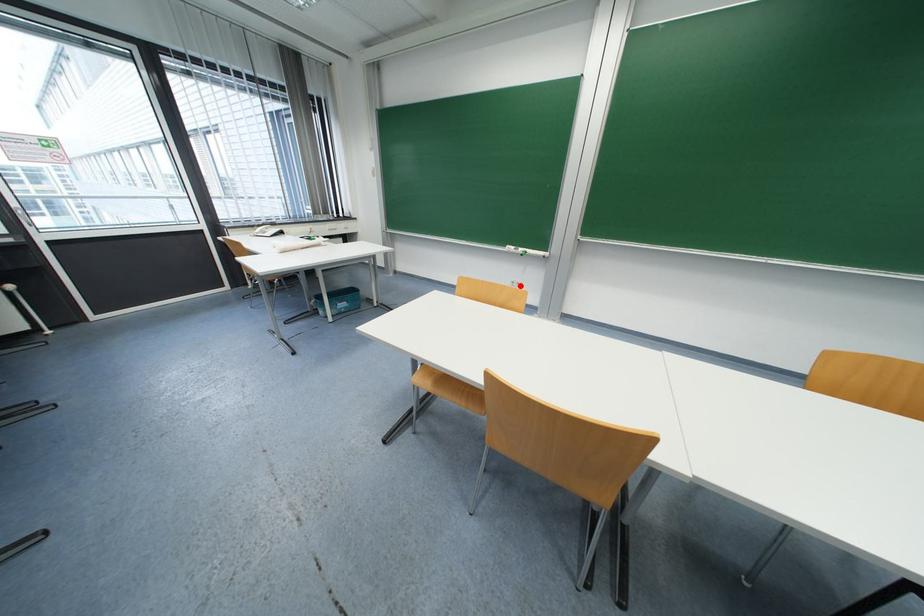
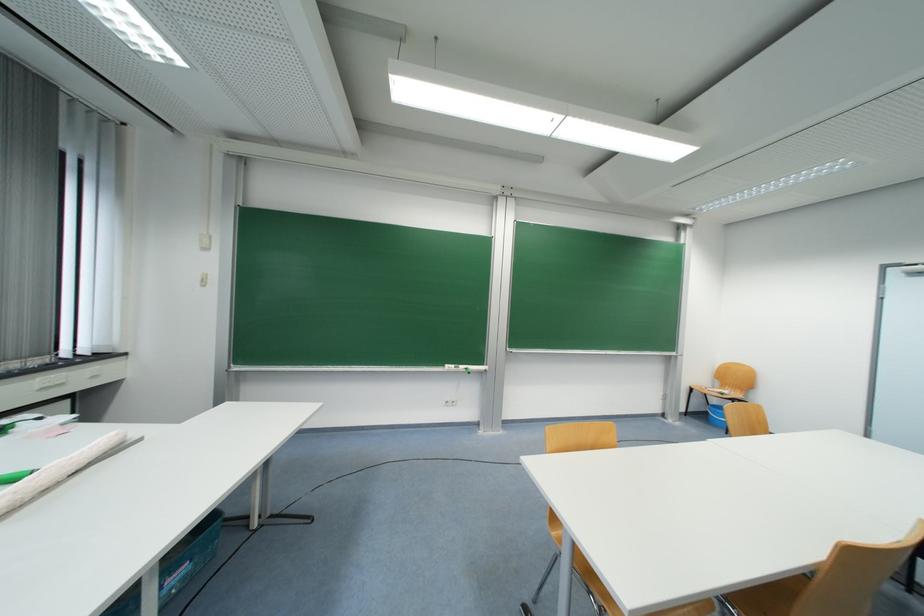
In the second image, find the point that corresponds to the highlighted location in the first image.

(455, 406)